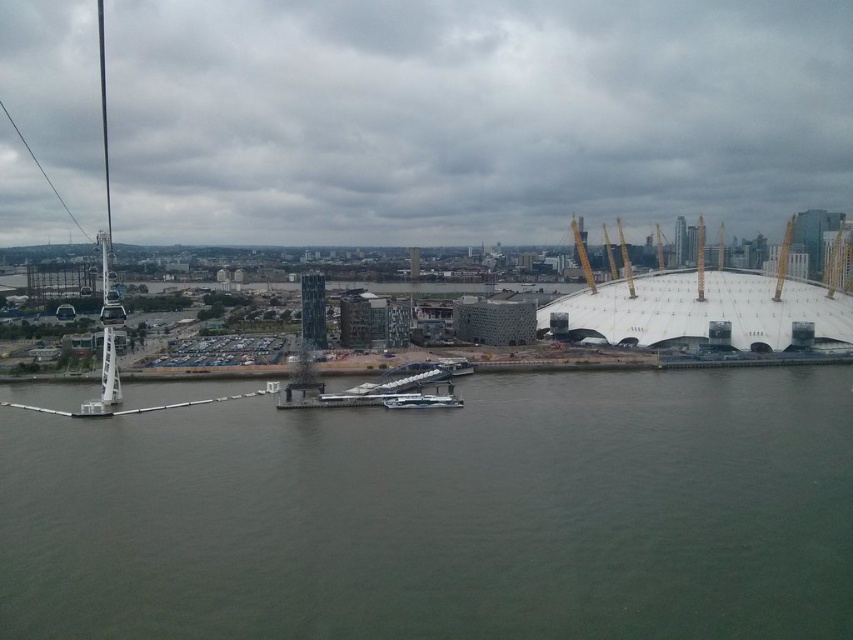
You are a tourist standing on the waterfront and see both the metallic silver boat at center and the white glossy boat at center. Which boat is directly above the other?

The metallic silver boat at center is positioned under the white glossy boat at center, so the white glossy boat at center is directly above the metallic silver boat at center.